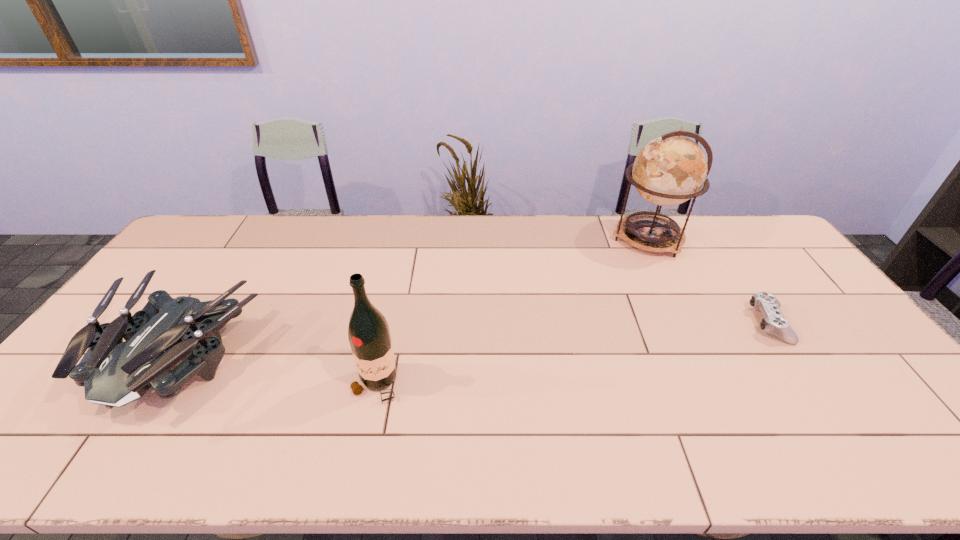
Locate an element on the screen. Image resolution: width=960 pixels, height=540 pixels. object that is the nearest to the third shortest object is located at coordinates (114, 373).

Locate which object ranks second in proximity to the control. Please provide its 2D coordinates. Your answer should be formatted as a tuple, i.e. [(x, y)], where the tuple contains the x and y coordinates of a point satisfying the conditions above.

[(368, 332)]

Image resolution: width=960 pixels, height=540 pixels. I want to click on free spot that satisfies the following two spatial constraints: 1. at the center of the tallest object; 2. on the left side of the rightmost object, so click(689, 324).

The image size is (960, 540). What are the coordinates of `free point that satisfies the following two spatial constraints: 1. at the center of the tallest object; 2. on the back side of the rightmost object` in the screenshot? It's located at (689, 324).